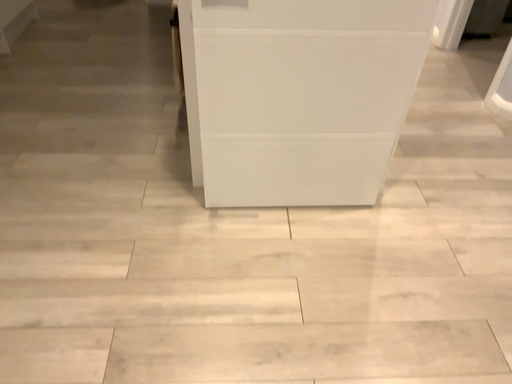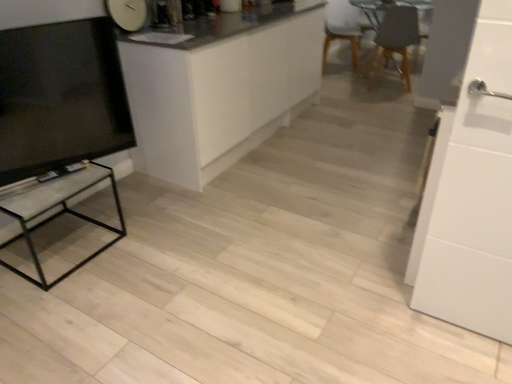
Question: How did the camera likely rotate when shooting the video?

Choices:
 (A) rotated left
 (B) rotated right

Answer: (A)